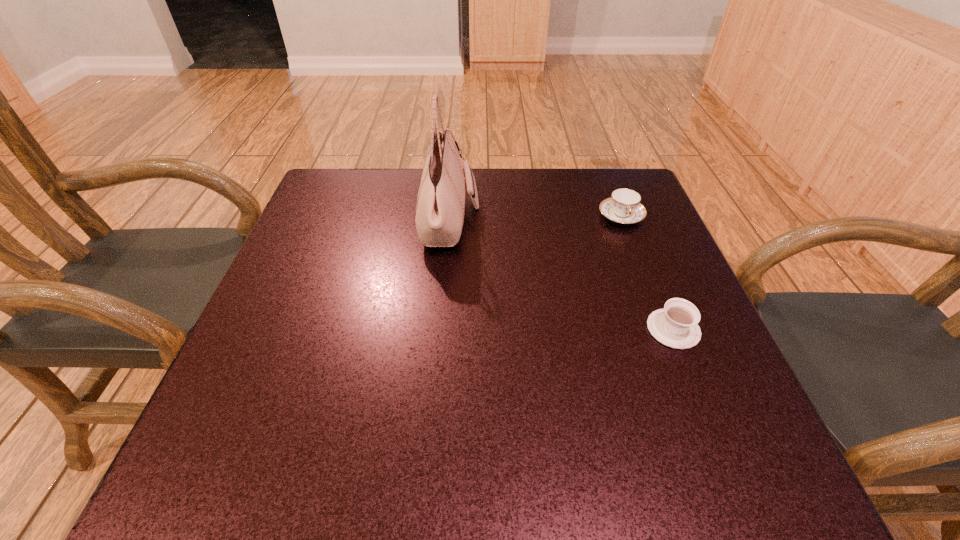
I want to click on handbag, so click(440, 207).

Where is `the tallest object`? This screenshot has width=960, height=540. the tallest object is located at coordinates (440, 207).

This screenshot has width=960, height=540. In order to click on the farther teacup in this screenshot , I will do `click(624, 206)`.

Find the location of a particular element. This screenshot has width=960, height=540. the nearer teacup is located at coordinates (676, 326).

Locate an element on the screen. The width and height of the screenshot is (960, 540). the shortest object is located at coordinates (676, 326).

This screenshot has width=960, height=540. What are the coordinates of `free space located 0.240m on the side of the leftmost object with the attached pouch` in the screenshot? It's located at (579, 220).

Where is `vacant space positioned on the side with the handle of the farther teacup`? vacant space positioned on the side with the handle of the farther teacup is located at coordinates (652, 295).

This screenshot has width=960, height=540. In order to click on vacant space located 0.270m on the handle side of the shorter teacup in this screenshot , I will do point(631,225).

Identify the location of free space located 0.270m on the handle side of the shorter teacup. This screenshot has width=960, height=540. (631, 225).

Find the location of a particular element. free space located on the handle side of the shorter teacup is located at coordinates (634, 230).